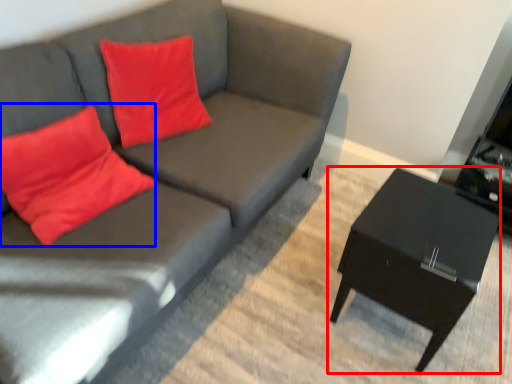
Question: Among these objects, which one is farthest to the camera, table (highlighted by a red box) or throw pillow (highlighted by a blue box)?

Choices:
 (A) table
 (B) throw pillow

Answer: (A)